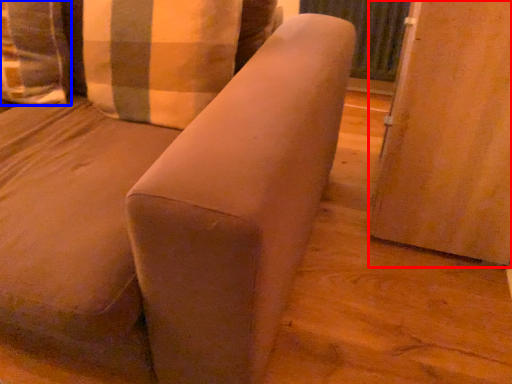
Question: Which object is closer to the camera taking this photo, screen door (highlighted by a red box) or pillow (highlighted by a blue box)?

Choices:
 (A) screen door
 (B) pillow

Answer: (A)